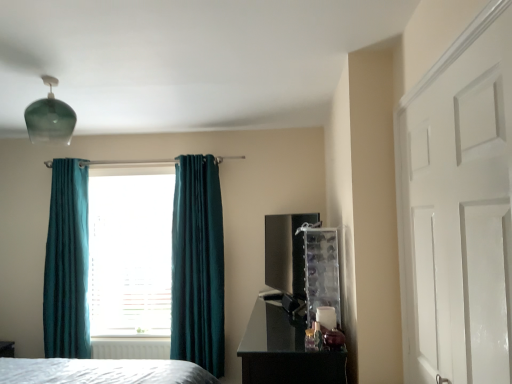
Question: Can you confirm if white plastic radiator at lower center is thinner than teal velvet curtain at left, positioned as the second curtain in right-to-left order?

Choices:
 (A) no
 (B) yes

Answer: (B)

Question: Is white plastic radiator at lower center oriented towards teal velvet curtain at left, the first curtain viewed from the left?

Choices:
 (A) yes
 (B) no

Answer: (B)

Question: Is white plastic radiator at lower center not inside teal velvet curtain at left, positioned as the second curtain in right-to-left order?

Choices:
 (A) yes
 (B) no

Answer: (A)

Question: Can you confirm if white plastic radiator at lower center is taller than teal velvet curtain at left, positioned as the second curtain in right-to-left order?

Choices:
 (A) yes
 (B) no

Answer: (B)

Question: Is white plastic radiator at lower center to the right of teal velvet curtain at left, positioned as the second curtain in right-to-left order, from the viewer's perspective?

Choices:
 (A) no
 (B) yes

Answer: (B)

Question: From a real-world perspective, is black glossy tv at center-right above or below glossy black dresser at lower right?

Choices:
 (A) above
 (B) below

Answer: (A)

Question: Is black glossy tv at center-right wider or thinner than glossy black dresser at lower right?

Choices:
 (A) wide
 (B) thin

Answer: (B)

Question: Relative to glossy black dresser at lower right, is black glossy tv at center-right in front or behind?

Choices:
 (A) behind
 (B) front

Answer: (A)

Question: From the image's perspective, relative to glossy black dresser at lower right, is black glossy tv at center-right above or below?

Choices:
 (A) below
 (B) above

Answer: (B)

Question: Considering the positions of point (198, 289) and point (106, 344), is point (198, 289) closer or farther from the camera than point (106, 344)?

Choices:
 (A) farther
 (B) closer

Answer: (B)

Question: Do you think teal velvet curtain at center, the first curtain when ordered from right to left, is within white plastic radiator at lower center, or outside of it?

Choices:
 (A) outside
 (B) inside

Answer: (A)

Question: From the image's perspective, is teal velvet curtain at center, the first curtain when ordered from right to left, above or below white plastic radiator at lower center?

Choices:
 (A) below
 (B) above

Answer: (B)

Question: From a real-world perspective, is teal velvet curtain at center, the first curtain when ordered from right to left, above or below white plastic radiator at lower center?

Choices:
 (A) below
 (B) above

Answer: (B)

Question: Relative to teal velvet curtain at left, the first curtain viewed from the left, is black glossy tv at center-right in front or behind?

Choices:
 (A) behind
 (B) front

Answer: (B)

Question: Is point (283, 269) closer or farther from the camera than point (60, 248)?

Choices:
 (A) closer
 (B) farther

Answer: (A)